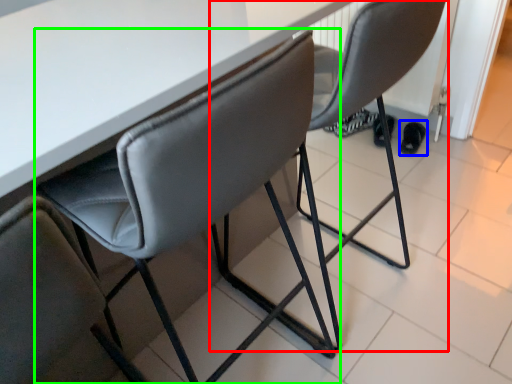
Question: Considering the real-world distances, which object is closest to chair (highlighted by a red box)? footwear (highlighted by a blue box) or chair (highlighted by a green box).

Choices:
 (A) footwear
 (B) chair

Answer: (B)